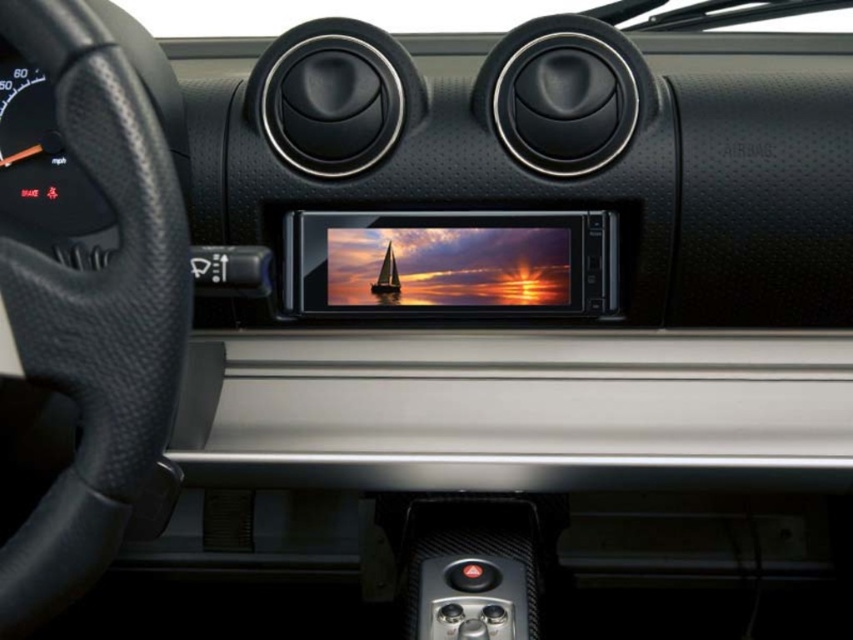
You are a mechanic working on a car. You need to install a camera that must be placed exactly 24 inches away from the black leather steering wheel at left. Based on the image, will the current placement of the camera meet the requirement?

The black leather steering wheel at left and camera are 23.32 inches apart, which is less than the required 24 inches. Therefore, the current placement does not meet the requirement.

You are sitting in the driver seat of the car and want to reach the point at coordinates point (144, 227) on the dashboard. Your hand can extend 24 inches from your body. Can you comfortably reach that point?

The point (144, 227) is 24.40 inches away from the viewer, which is slightly beyond your hand extension of 24 inches. Therefore, you might not be able to comfortably reach it.

You are sitting in the driver seat of the car and looking at the dashboard. Which object is closer to you between the black leather steering wheel at left and the satin black sailboat at center?

The black leather steering wheel at left is closer to the viewer than the satin black sailboat at center.